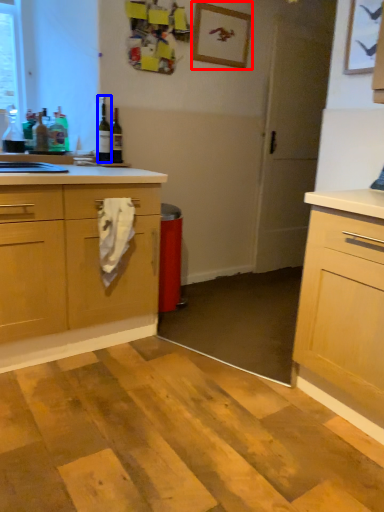
Question: Among these objects, which one is farthest to the camera, picture frame (highlighted by a red box) or bottle (highlighted by a blue box)?

Choices:
 (A) picture frame
 (B) bottle

Answer: (A)